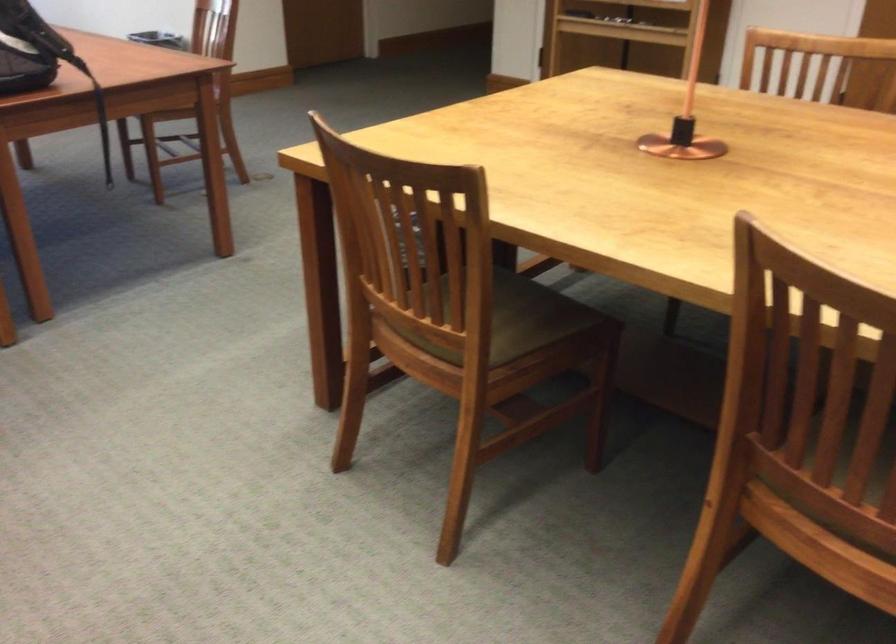
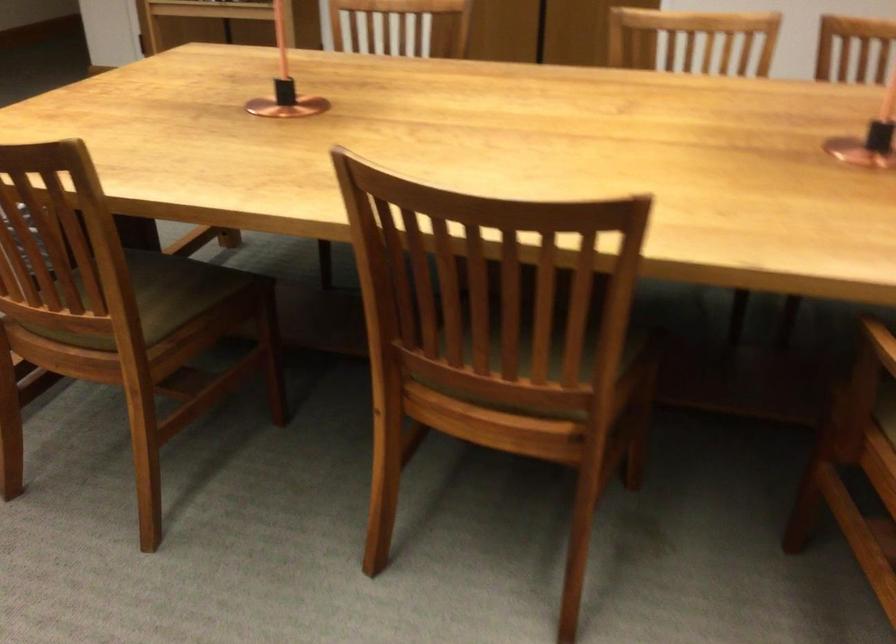
Question: The camera is either moving clockwise (left) or counter-clockwise (right) around the object. The first image is from the beginning of the video and the second image is from the end. Is the camera moving left or right when shooting the video?

Choices:
 (A) Left
 (B) Right

Answer: (A)